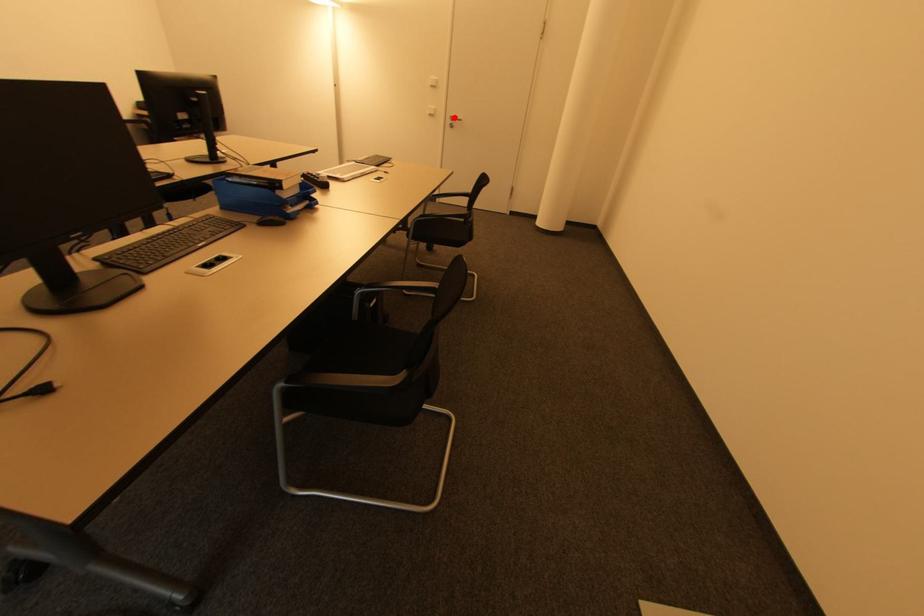
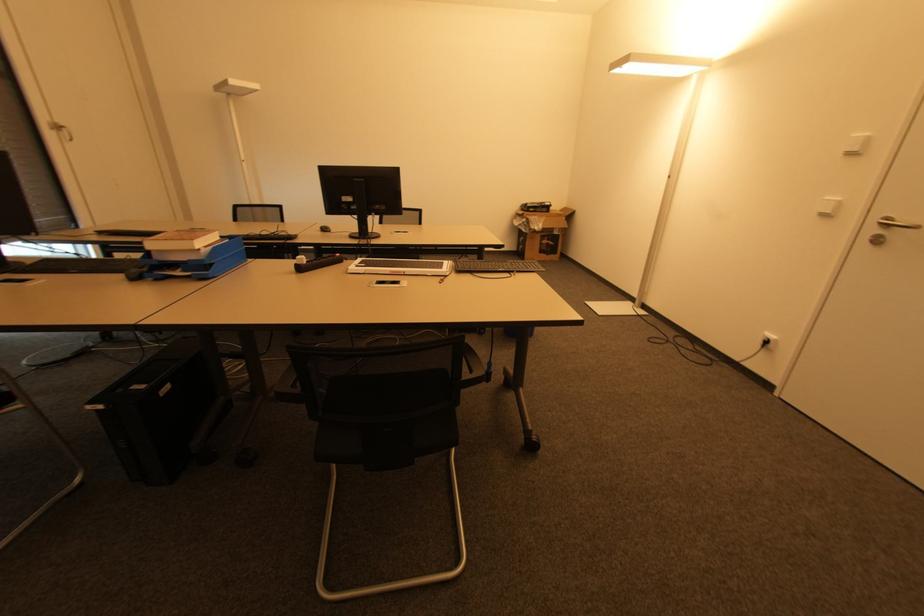
Question: I am providing you with two images of the same scene from different viewpoints. Given a red point in image1, look at the same physical point in image2. Is it:

Choices:
 (A) Closer to the viewpoint
 (B) Farther from the viewpoint

Answer: (B)